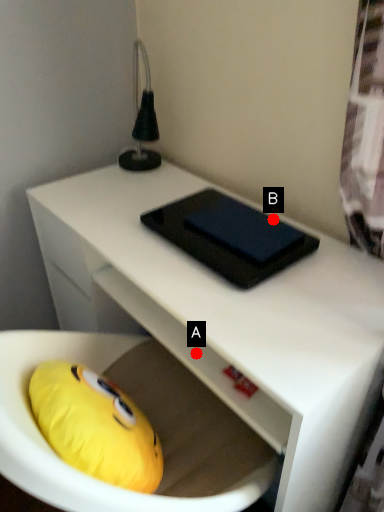
Question: Two points are circled on the image, labeled by A and B beside each circle. Among these points, which one is nearest to the camera?

Choices:
 (A) A is closer
 (B) B is closer

Answer: (A)